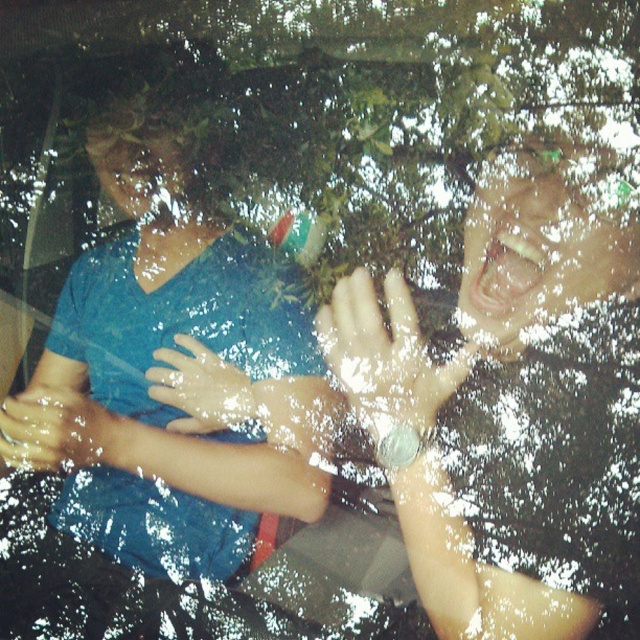
From the picture: Is transparent wet hand at center behind slightly translucent skin at center?

No, it is in front of slightly translucent skin at center.

Is point (380, 364) positioned behind point (172, 376)?

No, it is in front of (172, 376).

Who is more distant from viewer, [413,348] or [248,394]?

The point [248,394] is more distant.

At what (x,y) coordinates should I click in order to perform the action: click on transparent wet hand at center. Please return your answer as a coordinate pair (x, y). The width and height of the screenshot is (640, 640). Looking at the image, I should click on (385, 356).

Is blue matte shirt at upper left thinner than slick rubber hand at lower left?

In fact, blue matte shirt at upper left might be wider than slick rubber hand at lower left.

Is point (241, 257) positioned in front of point (26, 429)?

That is False.

Find the location of a particular element. This screenshot has width=640, height=640. blue matte shirt at upper left is located at coordinates (170, 348).

Find the location of `blue matte shirt at upper left`. blue matte shirt at upper left is located at coordinates (170, 348).

Who is more forward, (371, 381) or (74, 420)?

Point (371, 381)

Who is lower down, transparent wet hand at center or slick rubber hand at lower left?

slick rubber hand at lower left is lower down.

Is point (355, 344) farther from camera compared to point (28, 451)?

That is False.

Where is `transparent wet hand at center`? Image resolution: width=640 pixels, height=640 pixels. transparent wet hand at center is located at coordinates (385, 356).